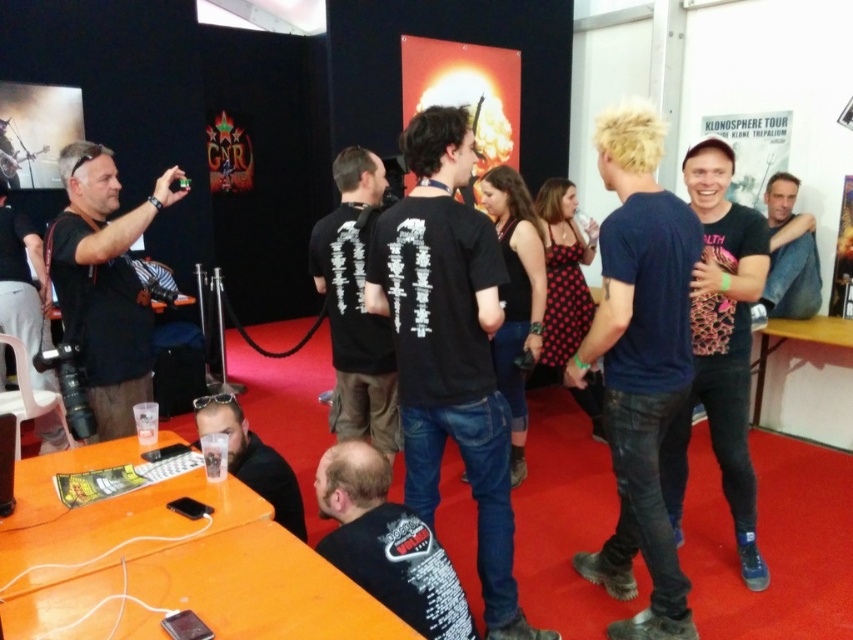
Which is more to the right, black matte shirt at center or black matte t-shirt at lower center?

black matte shirt at center

Between point (497, 314) and point (384, 461), which one is positioned behind?

The point (497, 314) is behind.

This screenshot has height=640, width=853. Describe the element at coordinates (450, 346) in the screenshot. I see `black matte shirt at center` at that location.

Where is `black matte shirt at center`? black matte shirt at center is located at coordinates (450, 346).

Who is taller, black matte camera at left or matte black shirt at lower left?

black matte camera at left

Is point (86, 234) in front of point (231, 410)?

Yes, it is.

You are a GUI agent. You are given a task and a screenshot of the screen. Output one action in this format:
    pyautogui.click(x=<x>, y=<y>)
    Task: Click on the black matte camera at left
    
    Given the screenshot: What is the action you would take?
    pyautogui.click(x=105, y=282)

Where is `black matte camera at left`? The height and width of the screenshot is (640, 853). black matte camera at left is located at coordinates (105, 282).

Measure the distance between blue denim jeans at right and black matte t-shirt at center.

3.31 feet

Consider the image. Which is more to the right, blue denim jeans at right or black matte t-shirt at center?

blue denim jeans at right

Locate an element on the screen. This screenshot has height=640, width=853. blue denim jeans at right is located at coordinates (639, 364).